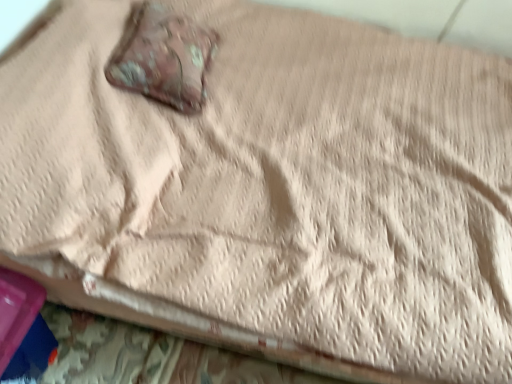
What do you see at coordinates (163, 58) in the screenshot? I see `floral fabric pillow at upper left` at bounding box center [163, 58].

The width and height of the screenshot is (512, 384). In order to click on floral fabric pillow at upper left in this screenshot , I will do `click(163, 58)`.

Identify the location of floral fabric pillow at upper left. The image size is (512, 384). (163, 58).